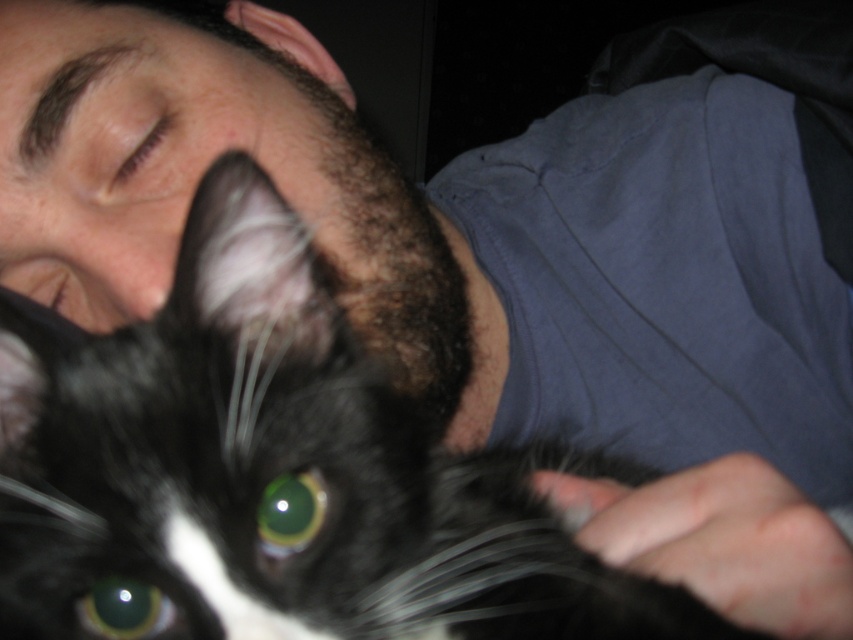
You are a pet groomer assessing the cat in the image. The black fur cat at center has a width of 30 cm. The black fur at center is part of the cat. Can the cat fit into a grooming cage that requires the animal to be narrower than 35 cm?

The black fur cat at center has a width of 30 cm, which is less than the 35 cm requirement for the grooming cage. Therefore, the cat can fit into the cage.

You are a photographer trying to capture a close shot of the black fur cat at center and the green glossy eye at center. Which one should you focus on first if you want to ensure both are in focus?

Since the black fur cat at center is in front of the green glossy eye at center, you should focus on the black fur cat at center first to ensure both are in focus.

You are a veterinarian examining a patient. You notice the black fur at center and the green glossy eye at center. Which one has a bigger size?

The black fur at center is larger in size than the green glossy eye at center.